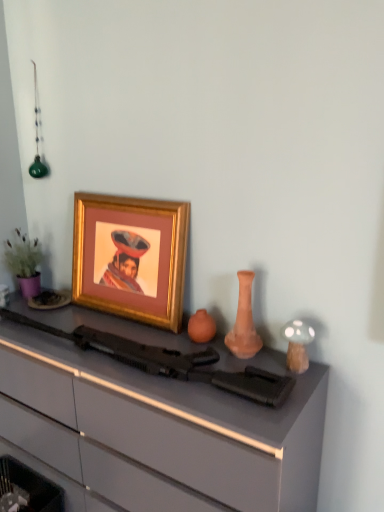
Question: Can you confirm if matte black rifle at center is positioned to the right of gold-framed picture at upper left?

Choices:
 (A) yes
 (B) no

Answer: (A)

Question: Considering the relative positions of matte black rifle at center and gold-framed picture at upper left in the image provided, is matte black rifle at center behind gold-framed picture at upper left?

Choices:
 (A) yes
 (B) no

Answer: (B)

Question: From a real-world perspective, is matte black rifle at center under gold-framed picture at upper left?

Choices:
 (A) no
 (B) yes

Answer: (B)

Question: Is matte black rifle at center facing towards gold-framed picture at upper left?

Choices:
 (A) yes
 (B) no

Answer: (B)

Question: Is matte black rifle at center outside of gold-framed picture at upper left?

Choices:
 (A) no
 (B) yes

Answer: (B)

Question: From the image's perspective, does matte black rifle at center appear lower than gold-framed picture at upper left?

Choices:
 (A) no
 (B) yes

Answer: (B)

Question: Can you confirm if matte gray desk at center is positioned to the left of matte black rifle at center?

Choices:
 (A) no
 (B) yes

Answer: (B)

Question: From a real-world perspective, is matte gray desk at center physically above matte black rifle at center?

Choices:
 (A) no
 (B) yes

Answer: (A)

Question: Is matte gray desk at center positioned in front of matte black rifle at center?

Choices:
 (A) yes
 (B) no

Answer: (A)

Question: Is matte gray desk at center placed right next to matte black rifle at center?

Choices:
 (A) yes
 (B) no

Answer: (B)

Question: Is matte gray desk at center bigger than matte black rifle at center?

Choices:
 (A) no
 (B) yes

Answer: (B)

Question: Is matte gray desk at center far from matte black rifle at center?

Choices:
 (A) yes
 (B) no

Answer: (B)

Question: Is white glossy mushroom at right completely or partially inside gold-framed picture at upper left?

Choices:
 (A) no
 (B) yes

Answer: (A)